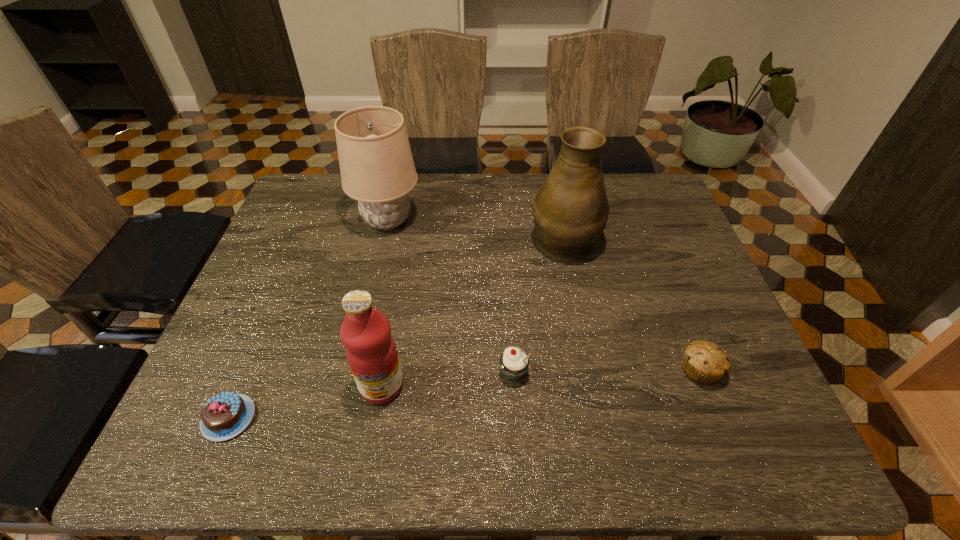
The width and height of the screenshot is (960, 540). I want to click on vacant area situated on the handle side of the fifth object from left to right, so click(x=553, y=185).

Identify the location of free spot located 0.220m on the handle side of the fifth object from left to right. (551, 174).

I want to click on free space located 0.070m on the front of the lampshade, so click(378, 260).

You are a GUI agent. You are given a task and a screenshot of the screen. Output one action in this format:
    pyautogui.click(x=<x>, y=<y>)
    Task: Click on the vacant space situated 0.090m on the label of the fruit juice
    This screenshot has height=540, width=960.
    Given the screenshot: What is the action you would take?
    pyautogui.click(x=371, y=449)

Locate an element on the screen. vacant space situated 0.350m on the back of the third shortest object is located at coordinates (506, 254).

I want to click on vacant space located 0.370m on the back of the fifth tallest object, so click(650, 245).

Identify the location of vacant space located 0.090m on the right of the shortest object. This screenshot has width=960, height=540. (299, 418).

I want to click on pitcher at the far edge, so click(x=570, y=211).

Find the location of a particular element. The height and width of the screenshot is (540, 960). lampshade at the far edge is located at coordinates (377, 169).

Locate an element on the screen. object that is at the near edge is located at coordinates (224, 416).